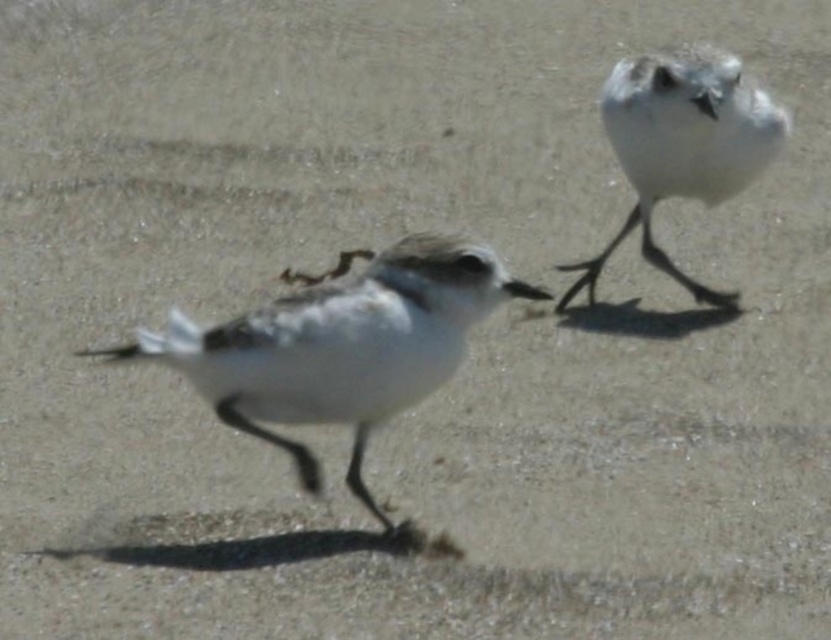
Question: Which object is farther from the camera taking this photo?

Choices:
 (A) white matte bird at upper right
 (B) white matte bird at center

Answer: (A)

Question: Is white matte bird at center positioned at the back of white matte bird at upper right?

Choices:
 (A) yes
 (B) no

Answer: (B)

Question: Is white matte bird at center thinner than white matte bird at upper right?

Choices:
 (A) yes
 (B) no

Answer: (B)

Question: Is white matte bird at center to the left of white matte bird at upper right from the viewer's perspective?

Choices:
 (A) yes
 (B) no

Answer: (A)